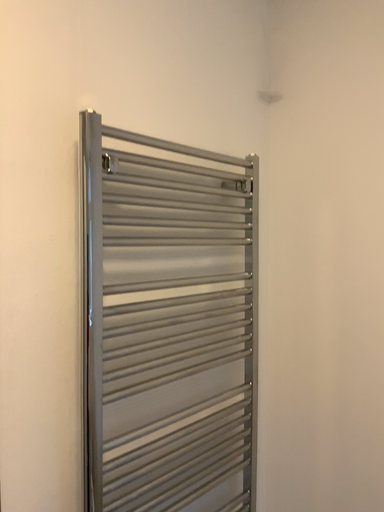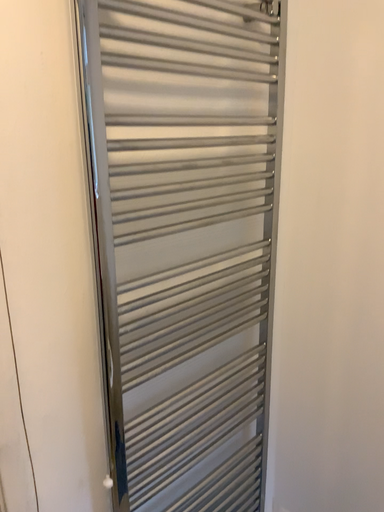
Question: How did the camera likely rotate when shooting the video?

Choices:
 (A) rotated downward
 (B) rotated upward

Answer: (A)